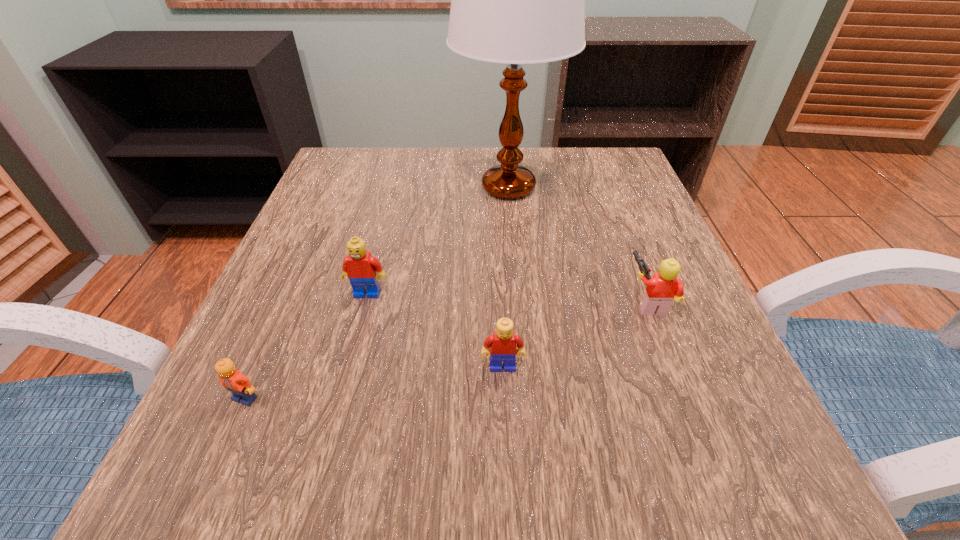
Locate an element on the screen. The height and width of the screenshot is (540, 960). free spot between the second object from left to right and the nearest Lego is located at coordinates (306, 346).

This screenshot has width=960, height=540. Identify the location of vacant area between the third farthest Lego and the rightmost Lego. (576, 335).

Find the location of a particular element. This screenshot has width=960, height=540. empty space between the rightmost Lego and the nearest Lego is located at coordinates (447, 350).

Point out which object is positioned as the third nearest to the third farthest Lego. Please provide its 2D coordinates. Your answer should be formatted as a tuple, i.e. [(x, y)], where the tuple contains the x and y coordinates of a point satisfying the conditions above.

[(233, 380)]

Identify which object is located as the fourth nearest to the rightmost object. Please provide its 2D coordinates. Your answer should be formatted as a tuple, i.e. [(x, y)], where the tuple contains the x and y coordinates of a point satisfying the conditions above.

[(233, 380)]

The width and height of the screenshot is (960, 540). Find the location of `Lego that stands as the closest to the second Lego from left to right`. Lego that stands as the closest to the second Lego from left to right is located at coordinates (233, 380).

You are a GUI agent. You are given a task and a screenshot of the screen. Output one action in this format:
    pyautogui.click(x=<x>, y=<y>)
    Task: Click on the Lego that is the third closest to the shortest Lego
    This screenshot has width=960, height=540.
    Given the screenshot: What is the action you would take?
    pyautogui.click(x=664, y=287)

In order to click on vacant region that satisfies the following two spatial constraints: 1. in front of the rightmost Lego with the accessory visible; 2. on the face of the fourth farthest object in this screenshot , I will do `click(674, 367)`.

Image resolution: width=960 pixels, height=540 pixels. I want to click on free spot that satisfies the following two spatial constraints: 1. in front of the rightmost object with the accessory visible; 2. on the front-facing side of the leftmost object, so click(x=685, y=398).

Locate an element on the screen. blank space that satisfies the following two spatial constraints: 1. in front of the rightmost Lego with the accessory visible; 2. on the front-facing side of the leftmost Lego is located at coordinates (685, 398).